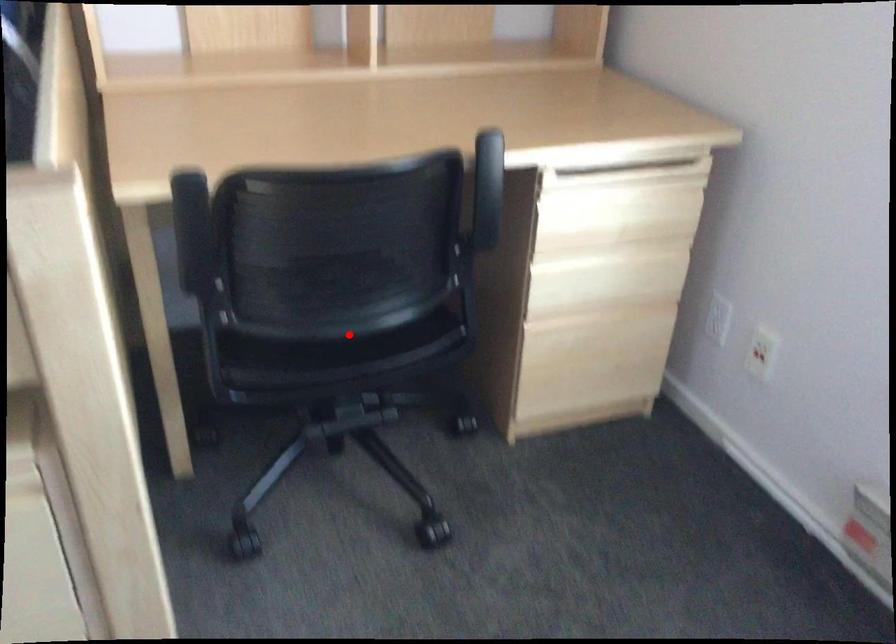
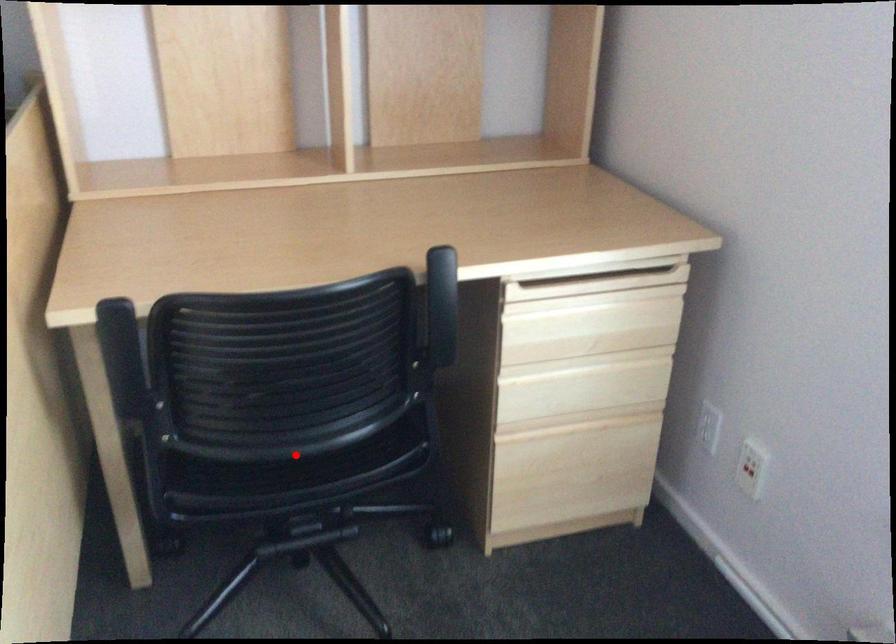
I am providing you with two images of the same scene from different viewpoints. A red point is marked on the first image and another point is marked on the second image. Is the red point in image1 aligned with the point shown in image2?

Yes